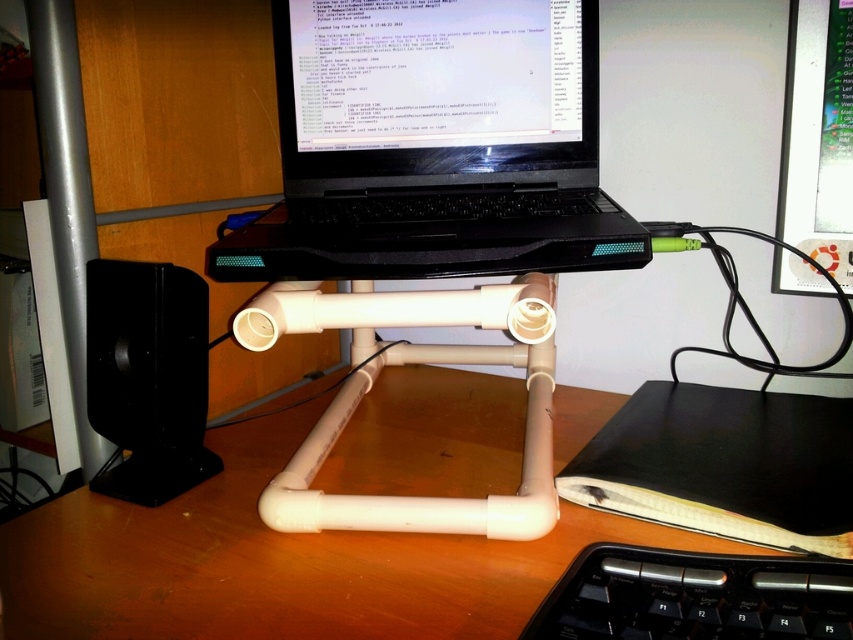
You are setting up a workspace and need to place both the black plastic laptop at center and the matte black monitor at upper right on a desk. Given their sizes, which object should you place first to ensure there is enough space for both?

The black plastic laptop at center is larger than the matte black monitor at upper right, so you should place the black plastic laptop at center first to ensure there is enough space for both.

You are looking at the DIY laptop stand and the speaker on the desk. If you were to draw a line from the point at (401, 147) to the point at (791, 192), would the line pass in front of or behind the laptop?

The line would pass in front of the laptop because point (401, 147) is closer to the camera than point (791, 192), so the line starts closer and moves away, staying in front of the laptop.

From the picture: You are setting up a new laptop stand and want to place the black glossy laptop at center so that it is exactly 70 centimeters away from the speaker. Currently, the distance between them is 76.45 centimeters. Should you move the laptop closer or farther away from the speaker to achieve the desired distance?

The current distance between the black glossy laptop at center and the speaker is 76.45 centimeters. To reduce this distance to 70 centimeters, you should move the laptop closer to the speaker by 6.45 centimeters.